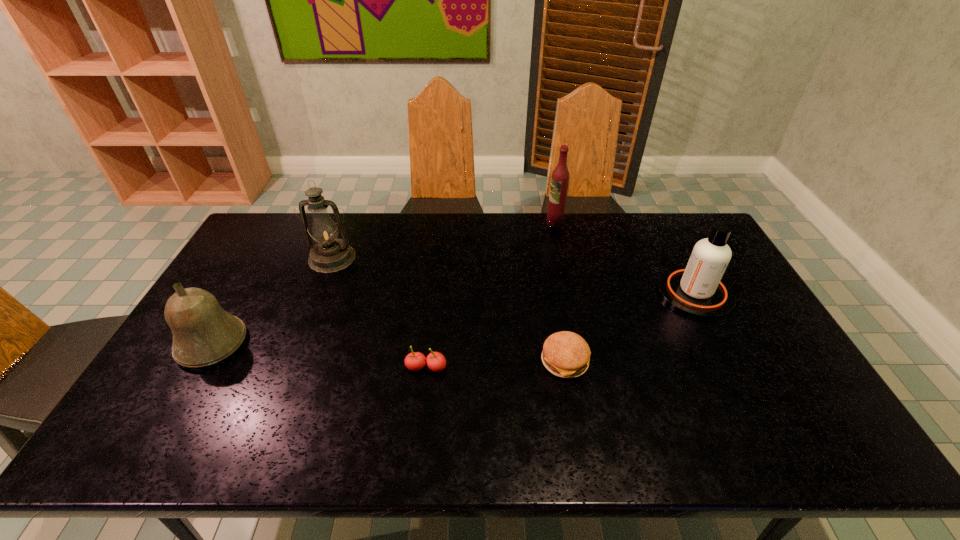
Find the location of a particular element. This screenshot has width=960, height=540. empty space between the bell and the rightmost object is located at coordinates tap(453, 318).

This screenshot has height=540, width=960. I want to click on object that is the fourth closest to the bell, so [560, 177].

Identify which object is the third closest to the farthest object. Please provide its 2D coordinates. Your answer should be formatted as a tuple, i.e. [(x, y)], where the tuple contains the x and y coordinates of a point satisfying the conditions above.

[(329, 255)]

Identify the location of vacant area that satisfies the following two spatial constraints: 1. on the label of the liquor; 2. on the front side of the cherry. The image size is (960, 540). coord(586,368).

Find the location of a particular element. This screenshot has width=960, height=540. vacant area in the image that satisfies the following two spatial constraints: 1. on the back side of the cherry; 2. on the right side of the cleansing agent is located at coordinates pyautogui.click(x=434, y=293).